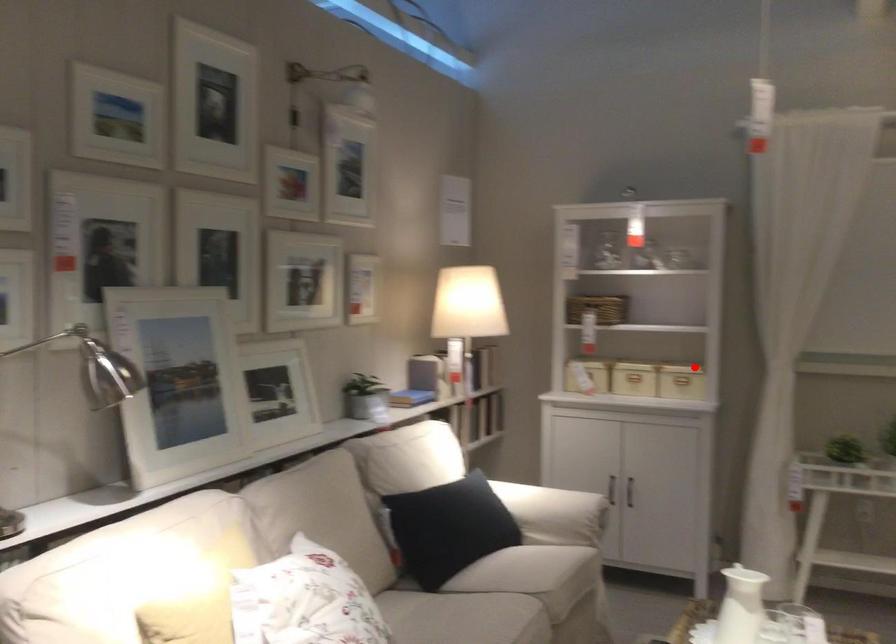
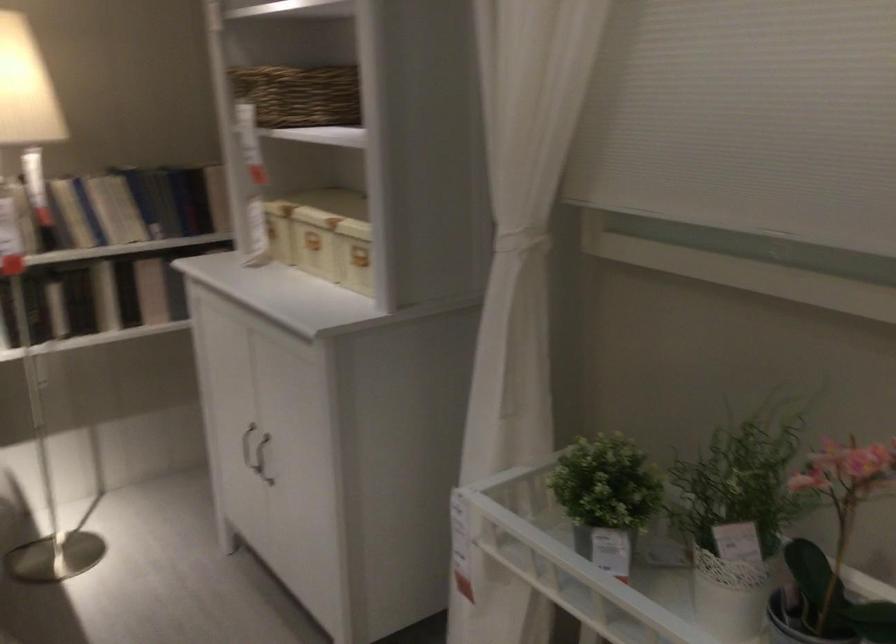
Question: I am providing you with two images of the same scene from different viewpoints. Given a red point in image1, look at the same physical point in image2. Is it:

Choices:
 (A) Closer to the viewpoint
 (B) Farther from the viewpoint

Answer: (A)